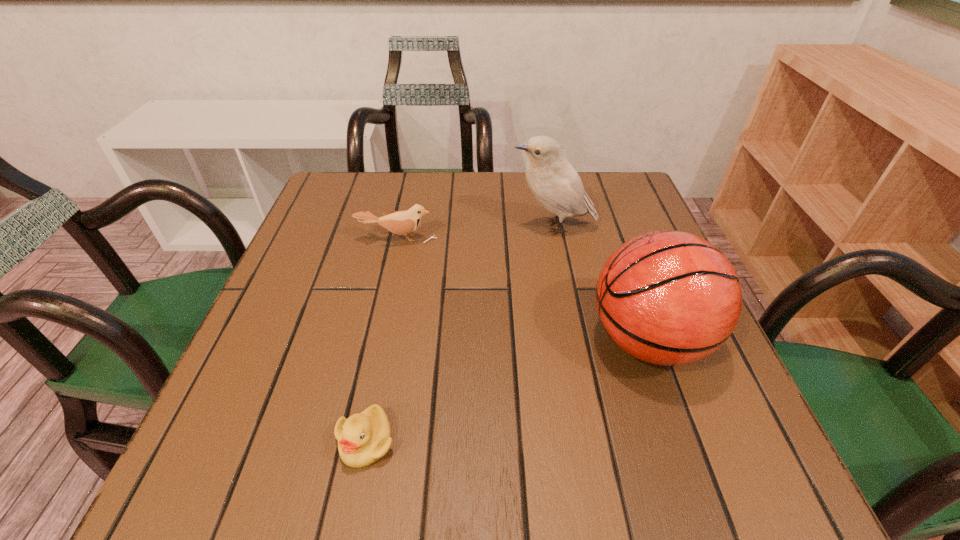
You are a GUI agent. You are given a task and a screenshot of the screen. Output one action in this format:
    pyautogui.click(x=<x>, y=<y>)
    Task: Click on the vacant space that is in between the left bird and the nearest object
    The width and height of the screenshot is (960, 540).
    Given the screenshot: What is the action you would take?
    pyautogui.click(x=381, y=340)

Identify the location of empty location between the basketball and the left bird. (522, 290).

Identify the location of empty space that is in between the third tallest object and the taller bird. The width and height of the screenshot is (960, 540). (475, 233).

I want to click on object that is the second closest to the third farthest object, so click(363, 438).

Identify the location of object that is the third closest to the taller bird. The height and width of the screenshot is (540, 960). (363, 438).

The image size is (960, 540). I want to click on vacant area in the image that satisfies the following two spatial constraints: 1. at the beak of the taller bird; 2. at the beak of the left bird, so click(x=556, y=239).

Identify the location of free space that satisfies the following two spatial constraints: 1. at the beak of the right bird; 2. at the beak of the second shortest object. (556, 239).

Where is `vacant point that satisfies the following two spatial constraints: 1. on the side with spill of the third farthest object; 2. on the front-facing side of the nearest object`? vacant point that satisfies the following two spatial constraints: 1. on the side with spill of the third farthest object; 2. on the front-facing side of the nearest object is located at coordinates (684, 441).

You are a GUI agent. You are given a task and a screenshot of the screen. Output one action in this format:
    pyautogui.click(x=<x>, y=<y>)
    Task: Click on the vacant area that satisfies the following two spatial constraints: 1. at the beak of the right bird; 2. on the front-facing side of the nearest object
    This screenshot has height=540, width=960.
    Given the screenshot: What is the action you would take?
    pyautogui.click(x=596, y=441)

This screenshot has width=960, height=540. What are the coordinates of `free space in the image that satisfies the following two spatial constraints: 1. on the side with spill of the basketball; 2. on the front-facing side of the nearest object` in the screenshot? It's located at (684, 441).